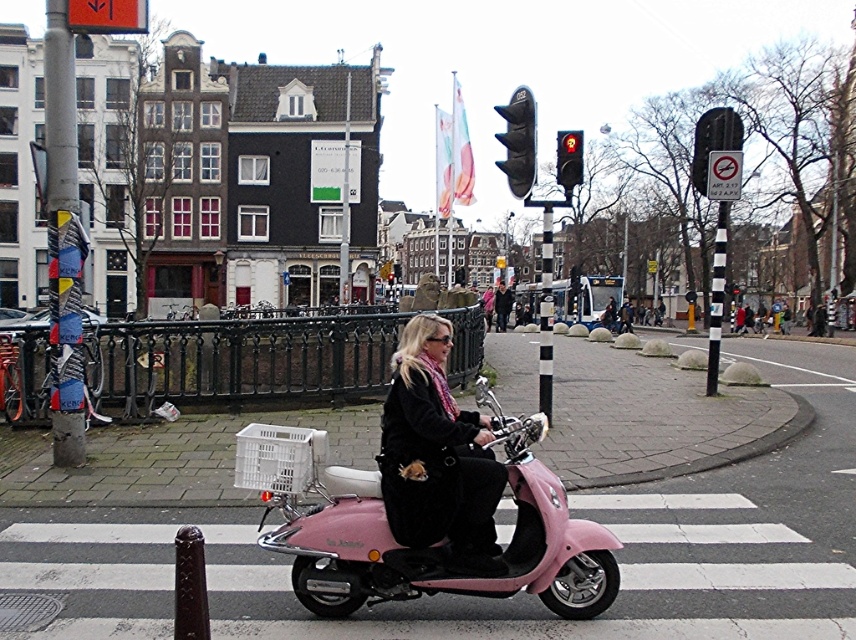
In the scene shown: You are a pedestrian standing at the crosswalk and want to cross the street. There is a pink matte scooter at center and a red glass traffic light at upper center. Which object is closer to your left side?

The pink matte scooter at center is to the left of red glass traffic light at upper center, so the pink matte scooter at center is closer to your left side.